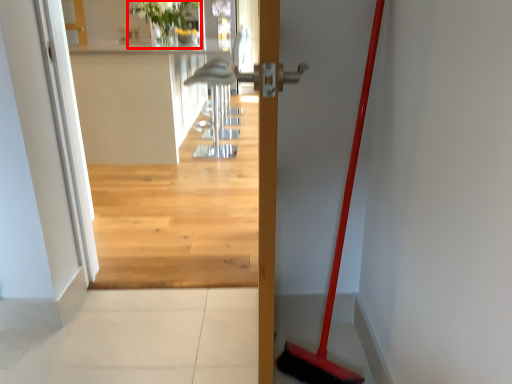
Question: From the image, what is the correct spatial relationship of plant (annotated by the red box) in relation to door?

Choices:
 (A) right
 (B) left

Answer: (B)